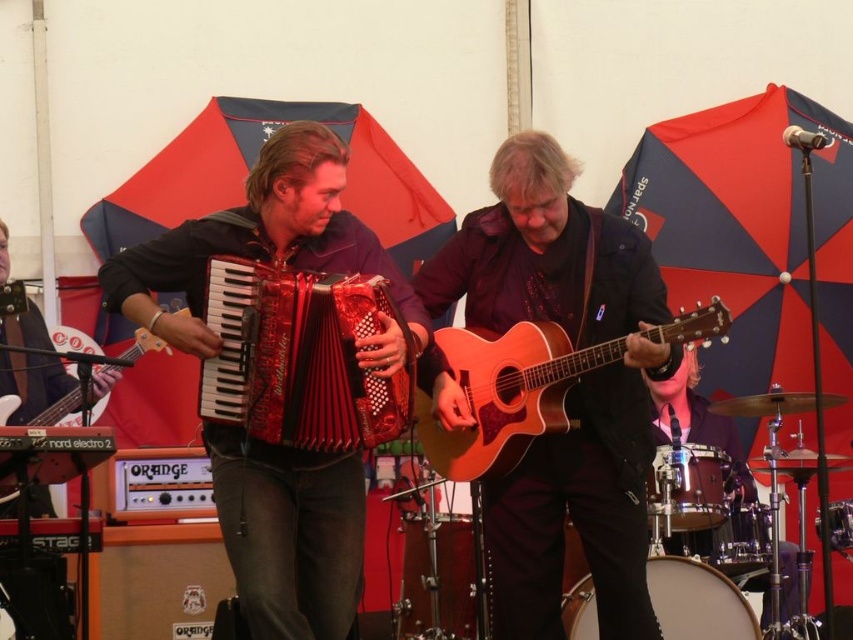
Does metallic red accordion at center appear under natural wood acoustic guitar at center?

Actually, metallic red accordion at center is above natural wood acoustic guitar at center.

Which is above, metallic red accordion at center or natural wood acoustic guitar at center?

metallic red accordion at center is higher up.

Is point (207, 444) positioned before point (714, 317)?

No.

Where is `metallic red accordion at center`? metallic red accordion at center is located at coordinates (259, 241).

Does metallic red accordion at center have a lesser height compared to matte black guitar at center?

Incorrect, metallic red accordion at center's height does not fall short of matte black guitar at center's.

Who is positioned more to the left, metallic red accordion at center or matte black guitar at center?

matte black guitar at center

Who is more distant from viewer, (347, 516) or (70, 392)?

The point (70, 392) is more distant.

The width and height of the screenshot is (853, 640). What are the coordinates of `metallic red accordion at center` in the screenshot? It's located at [259, 241].

Which is behind, point (222, 282) or point (456, 456)?

The point (456, 456) is more distant.

Which is in front, point (378, 275) or point (437, 461)?

Point (378, 275)

Locate an element on the screen. The image size is (853, 640). red shiny accordion at center is located at coordinates (300, 356).